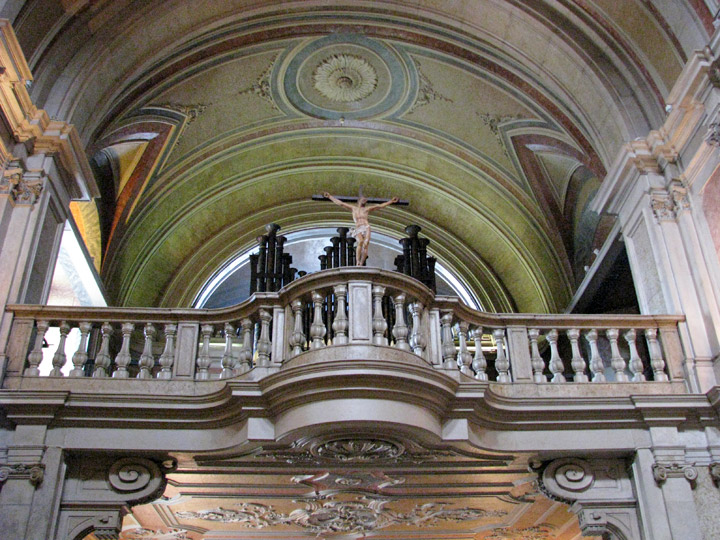
You are a GUI agent. You are given a task and a screenshot of the screen. Output one action in this format:
    pyautogui.click(x=<x>, y=<y>)
    Task: Click on the window
    The height and width of the screenshot is (540, 720).
    Given the screenshot: What is the action you would take?
    pyautogui.click(x=310, y=256)